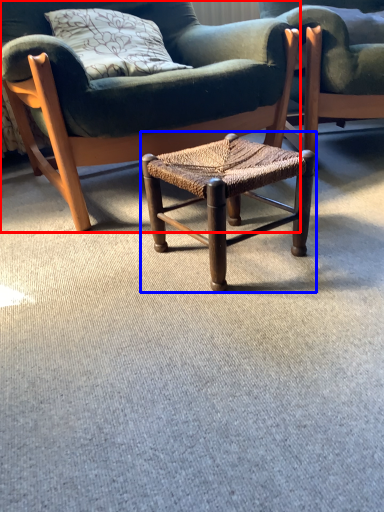
Question: Which of the following is the farthest to the observer, chair (highlighted by a red box) or stool (highlighted by a blue box)?

Choices:
 (A) chair
 (B) stool

Answer: (A)